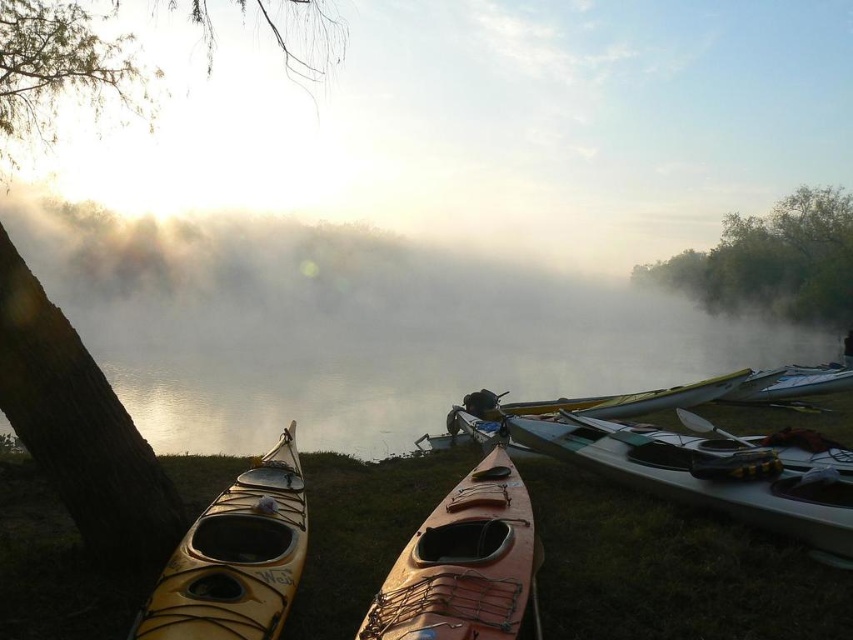
Question: Estimate the real-world distances between objects in this image. Which object is closer to the matte white kayak at center?

Choices:
 (A) matte yellow kayak at lower left
 (B) matte orange kayak at center
 (C) green leafy tree at upper left
 (D) green matte tree at upper right

Answer: (B)

Question: Considering the real-world distances, which object is closest to the matte white kayak at center?

Choices:
 (A) matte orange kayak at center
 (B) brown rough bark tree at left

Answer: (A)

Question: Can you confirm if green matte tree at upper right is smaller than white glossy kayak at right?

Choices:
 (A) yes
 (B) no

Answer: (B)

Question: Is matte white kayak at center positioned before matte yellow kayak at lower left?

Choices:
 (A) yes
 (B) no

Answer: (B)

Question: Estimate the real-world distances between objects in this image. Which object is farther from the matte white kayak at center?

Choices:
 (A) green matte tree at upper right
 (B) matte orange kayak at center
 (C) brown rough bark tree at left

Answer: (A)

Question: From the image, what is the correct spatial relationship of brown rough bark tree at left in relation to white glossy kayak at right?

Choices:
 (A) right
 (B) left

Answer: (B)